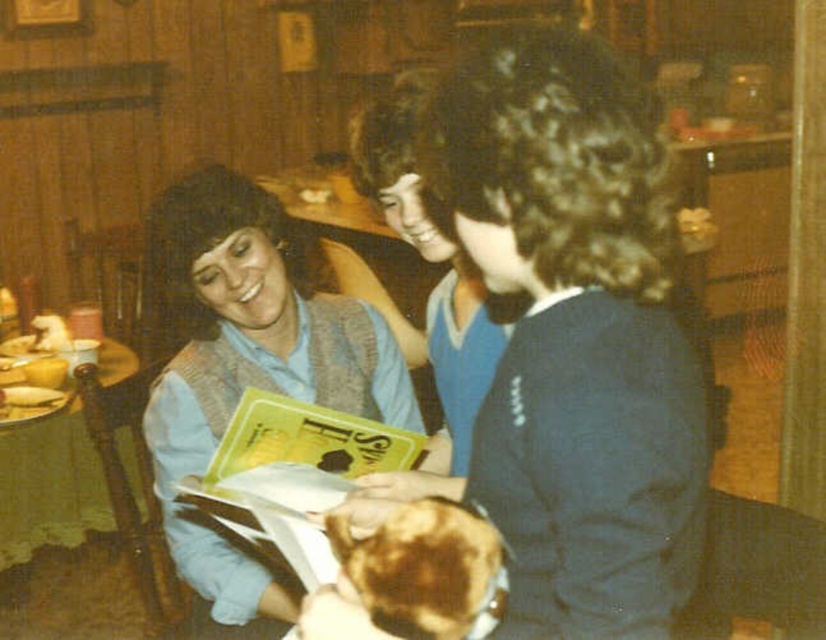
Question: Which point appears farthest from the camera in this image?

Choices:
 (A) (393, 572)
 (B) (2, 490)
 (C) (188, 314)

Answer: (B)

Question: Which of the following is the closest to the observer?

Choices:
 (A) (249, 273)
 (B) (525, 358)
 (C) (302, 413)

Answer: (B)

Question: Can you confirm if matte blue sweater at center is bigger than yellow paper book at center?

Choices:
 (A) no
 (B) yes

Answer: (B)

Question: Where is yellow paper book at center located in relation to brown crispy bread at lower center in the image?

Choices:
 (A) below
 (B) above

Answer: (B)

Question: Which object is positioned farthest from the dark blue sweater at center?

Choices:
 (A) wooden table at lower left
 (B) matte blue sweater at center
 (C) brown crispy bread at lower center

Answer: (A)

Question: Is yellow paper book at center thinner than wooden table at lower left?

Choices:
 (A) no
 (B) yes

Answer: (B)